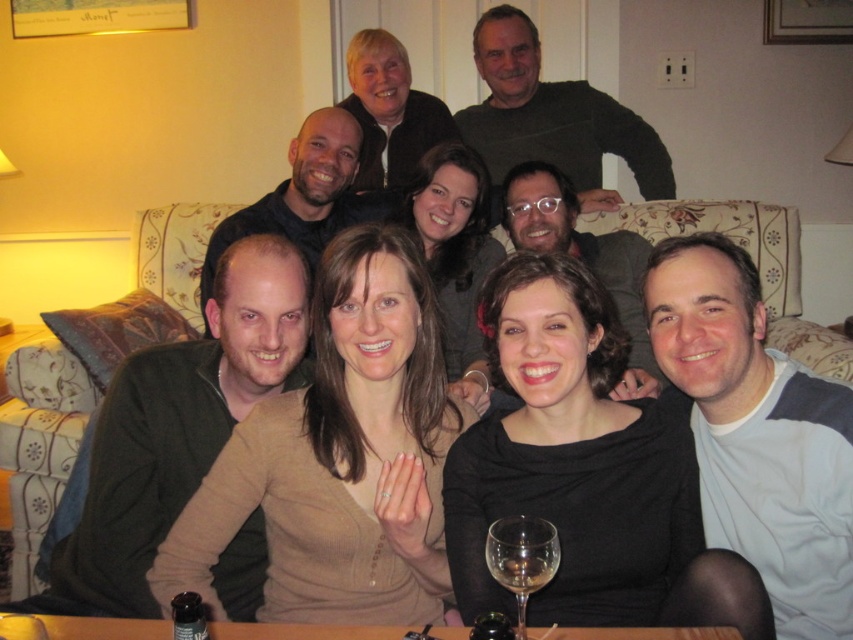
You are standing at the entrance of the living room and see the wooden table at lower center. If you walk straight towards it, will you reach it before the sofa with floral designs?

The wooden table at lower center is positioned at point (302,632), so yes, you will reach it before the sofa with floral designs because it is closer to your starting position at the entrance.

You are a photographer standing at the camera position. You want to place a decorative vase on the wooden table at lower center so that it is visible in the photo. Considering the distance between you and the table, can you reach the table without moving closer than your current position?

The wooden table at lower center is 39.08 inches away from camera. Since the photographer is at the camera position, they can reach the table within arm length to place the vase without needing to move closer.

You are a photographer setting up for a group photo in this living room. You need to ensure that the wooden table at lower center and the clear glass wine glass at lower center are both visible in the shot. Given their heights, which object might require you to adjust your camera angle to include it properly?

The wooden table at lower center is shorter than the clear glass wine glass at lower center, so the table might require adjusting the camera angle to ensure it is visible in the shot.